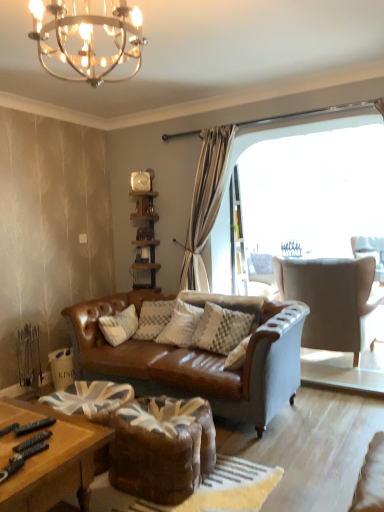
This screenshot has height=512, width=384. What are the coordinates of `clear glass screen door at center` in the screenshot? It's located at (236, 234).

Measure the distance between metallic chandelier at upper center and camera.

metallic chandelier at upper center is 4.61 feet away from camera.

What is the approximate width of metallic chandelier at upper center?

metallic chandelier at upper center is 15.75 inches wide.

Locate an element on the screen. leather swivel chair at center is located at coordinates (162, 448).

Find the location of a particular element. The width and height of the screenshot is (384, 512). wooden polished coffee table at lower left is located at coordinates click(52, 460).

You are a GUI agent. You are given a task and a screenshot of the screen. Output one action in this format:
    pyautogui.click(x=<x>, y=<y>)
    Task: Click on the suede-like beige armchair at right
    The image size is (384, 512).
    Given the screenshot: What is the action you would take?
    pyautogui.click(x=333, y=301)

Does metallic chandelier at upper center turn towards leather swivel chair at center?

No, metallic chandelier at upper center is not oriented towards leather swivel chair at center.

Which is in front, point (100, 84) or point (178, 452)?

The point (178, 452) is in front.

How many degrees apart are the facing directions of metallic chandelier at upper center and leather swivel chair at center?

The facing directions of metallic chandelier at upper center and leather swivel chair at center are 178 degrees apart.

From a real-world perspective, is woodenshelf at center positioned above or below wooden polished coffee table at lower left?

In terms of real-world spatial position, woodenshelf at center is above wooden polished coffee table at lower left.

Between woodenshelf at center and wooden polished coffee table at lower left, which one has smaller size?

woodenshelf at center is smaller.

Consider the image. From the image's perspective, which object appears higher, woodenshelf at center or wooden polished coffee table at lower left?

woodenshelf at center, from the image's perspective.

What's the angular difference between woodenshelf at center and wooden polished coffee table at lower left's facing directions?

There is a 89.7-degree angle between the facing directions of woodenshelf at center and wooden polished coffee table at lower left.

From a real-world perspective, relative to clear glass screen door at center, is woodenshelf at center vertically above or below?

woodenshelf at center is situated lower than clear glass screen door at center in the real world.

Is woodenshelf at center oriented towards clear glass screen door at center?

No, woodenshelf at center is not facing towards clear glass screen door at center.

Looking at this image, does woodenshelf at center appear on the left side of clear glass screen door at center?

Yes.

Where is `shelf that appears on the right of wooden polished coffee table at lower left`? The width and height of the screenshot is (384, 512). shelf that appears on the right of wooden polished coffee table at lower left is located at coordinates (144, 230).

From the image's perspective, which is above, wooden polished coffee table at lower left or woodenshelf at center?

From the image's view, woodenshelf at center is above.

Is wooden polished coffee table at lower left closer to the viewer compared to woodenshelf at center?

Yes, wooden polished coffee table at lower left is closer to the camera.

Is wooden polished coffee table at lower left positioned beyond the bounds of woodenshelf at center?

Absolutely, wooden polished coffee table at lower left is external to woodenshelf at center.

Between point (349, 263) and point (152, 175), which one is positioned in front?

The point (349, 263) is closer.

How different are the orientations of suede-like beige armchair at right and woodenshelf at center in degrees?

There is a 179-degree angle between the facing directions of suede-like beige armchair at right and woodenshelf at center.

Which of these two, suede-like beige armchair at right or woodenshelf at center, is thinner?

woodenshelf at center is thinner.

Measure the distance from clear glass screen door at center to suede-like beige armchair at right.

clear glass screen door at center is 80.90 centimeters away from suede-like beige armchair at right.

Which of these two, clear glass screen door at center or suede-like beige armchair at right, is thinner?

clear glass screen door at center is thinner.

Would you consider clear glass screen door at center to be distant from suede-like beige armchair at right?

They are positioned close to each other.

Where is `chair that appears below the clear glass screen door at center (from the image's perspective)`? The height and width of the screenshot is (512, 384). chair that appears below the clear glass screen door at center (from the image's perspective) is located at coordinates (333, 301).

From a real-world perspective, who is located lower, metallic chandelier at upper center or wooden polished coffee table at lower left?

From a 3D spatial view, wooden polished coffee table at lower left is below.

Is metallic chandelier at upper center aimed at wooden polished coffee table at lower left?

No, metallic chandelier at upper center is not facing towards wooden polished coffee table at lower left.

How many degrees apart are the facing directions of metallic chandelier at upper center and wooden polished coffee table at lower left?

The angle between the facing direction of metallic chandelier at upper center and the facing direction of wooden polished coffee table at lower left is 91.1 degrees.

From the image's perspective, which one is positioned lower, metallic chandelier at upper center or wooden polished coffee table at lower left?

wooden polished coffee table at lower left is shown below in the image.

There is a leather swivel chair at center. Where is `light fixture above it (from a real-world perspective)`? light fixture above it (from a real-world perspective) is located at coordinates (88, 39).

Where is `shelf that appears on the right of wooden polished coffee table at lower left`? shelf that appears on the right of wooden polished coffee table at lower left is located at coordinates pos(144,230).

Looking at the image, which one is located further to leather swivel chair at center, wooden polished coffee table at lower left or metallic chandelier at upper center?

metallic chandelier at upper center is positioned further to the anchor leather swivel chair at center.

Estimate the real-world distances between objects in this image. Which object is closer to wooden polished coffee table at lower left, woodenshelf at center or clear glass screen door at center?

woodenshelf at center is positioned closer to the anchor wooden polished coffee table at lower left.

When comparing their distances from clear glass screen door at center, does woodenshelf at center or suede-like beige armchair at right seem further?

The object further to clear glass screen door at center is woodenshelf at center.

Based on their spatial positions, is metallic chandelier at upper center or woodenshelf at center closer to suede-like beige armchair at right?

Based on the image, woodenshelf at center appears to be nearer to suede-like beige armchair at right.

Looking at the image, which one is located closer to suede-like beige armchair at right, woodenshelf at center or wooden polished coffee table at lower left?

woodenshelf at center lies closer to suede-like beige armchair at right than the other object.

From the image, which object appears to be farther from leather swivel chair at center, metallic chandelier at upper center or clear glass screen door at center?

clear glass screen door at center is further to leather swivel chair at center.

Estimate the real-world distances between objects in this image. Which object is closer to suede-like beige armchair at right, leather swivel chair at center or wooden polished coffee table at lower left?

leather swivel chair at center.

Considering their positions, is woodenshelf at center positioned further to metallic chandelier at upper center than wooden polished coffee table at lower left?

woodenshelf at center is further to metallic chandelier at upper center.

I want to click on chair located between metallic chandelier at upper center and clear glass screen door at center in the depth direction, so click(x=333, y=301).

This screenshot has width=384, height=512. Identify the location of coffee table located between metallic chandelier at upper center and suede-like beige armchair at right in the depth direction. (52, 460).

The width and height of the screenshot is (384, 512). Identify the location of chair between wooden polished coffee table at lower left and clear glass screen door at center along the z-axis. (333, 301).

Image resolution: width=384 pixels, height=512 pixels. I want to click on swivel chair between metallic chandelier at upper center and suede-like beige armchair at right in the front-back direction, so (162, 448).